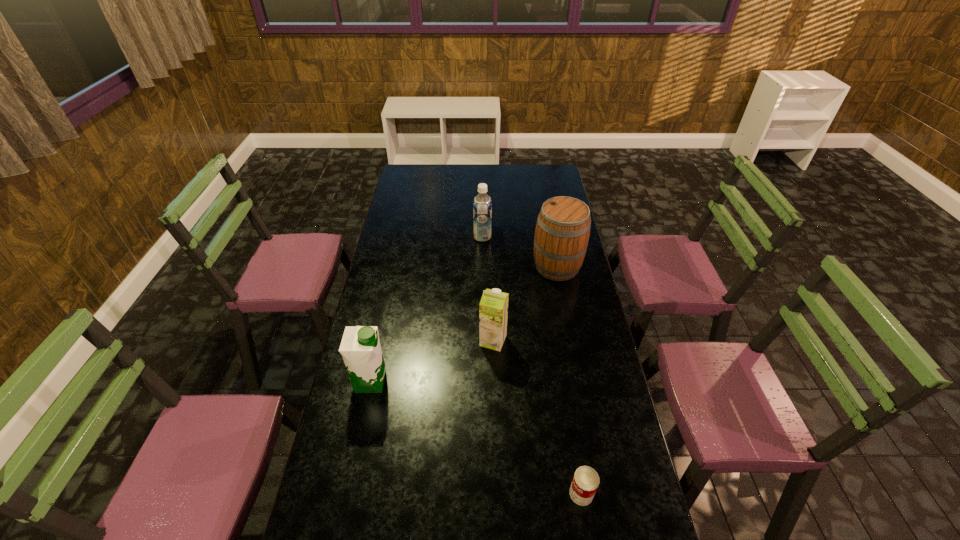
Identify the location of free region at the left edge of the desktop. (346, 483).

I want to click on vacant position at the right edge of the desktop, so click(x=578, y=416).

Identify the location of free space between the fourth nearest object and the fourth farthest object. The height and width of the screenshot is (540, 960). (464, 324).

Where is `vacant area that lies between the shortest object and the farthest soya milk`? This screenshot has height=540, width=960. vacant area that lies between the shortest object and the farthest soya milk is located at coordinates (532, 365).

Locate an element on the screen. The height and width of the screenshot is (540, 960). unoccupied position between the farthest soya milk and the can is located at coordinates (532, 365).

At what (x,y) coordinates should I click in order to perform the action: click on free space that is in between the third farthest object and the nearest object. Please return your answer as a coordinate pair (x, y). The height and width of the screenshot is (540, 960). Looking at the image, I should click on (538, 417).

Where is `free space that is in between the second farthest object and the farthest soya milk`? Image resolution: width=960 pixels, height=540 pixels. free space that is in between the second farthest object and the farthest soya milk is located at coordinates click(519, 252).

Identify the location of free space between the can and the nearest soya milk. (476, 437).

Where is `free area in between the leftmost object and the shortest object`? Image resolution: width=960 pixels, height=540 pixels. free area in between the leftmost object and the shortest object is located at coordinates (476, 437).

The height and width of the screenshot is (540, 960). What are the coordinates of `free point between the fourth farthest object and the farthest object` in the screenshot? It's located at (426, 309).